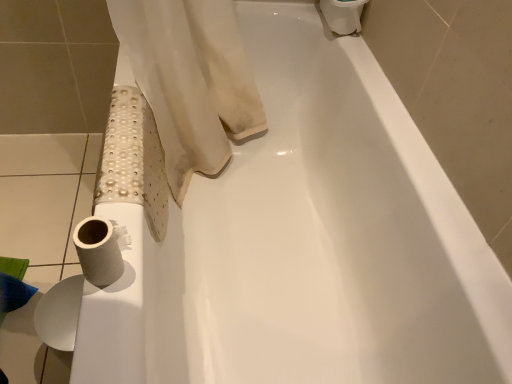
Question: From the image's perspective, does white matte toilet paper at upper right, which is counted as the first toilet paper, starting from the right, appear higher than white matte toilet paper at lower left, the 2th toilet paper when ordered from back to front?

Choices:
 (A) yes
 (B) no

Answer: (A)

Question: Does white matte toilet paper at upper right, arranged as the third toilet paper when viewed from the front, appear on the right side of white matte toilet paper at lower left, the 3th toilet paper in the right-to-left sequence?

Choices:
 (A) no
 (B) yes

Answer: (B)

Question: From the image's perspective, does white matte toilet paper at upper right, arranged as the third toilet paper when viewed from the front, appear lower than white matte toilet paper at lower left, arranged as the 2th toilet paper when viewed from the front?

Choices:
 (A) no
 (B) yes

Answer: (A)

Question: From a real-world perspective, does white matte toilet paper at upper right, arranged as the third toilet paper when viewed from the front, sit lower than white matte toilet paper at lower left, the first toilet paper in the left-to-right sequence?

Choices:
 (A) yes
 (B) no

Answer: (B)

Question: Can you confirm if white matte toilet paper at upper right, the 1th toilet paper viewed from the top, is smaller than white matte toilet paper at lower left, arranged as the 2th toilet paper when viewed from the front?

Choices:
 (A) no
 (B) yes

Answer: (A)

Question: Is the position of white matte toilet paper at upper right, arranged as the third toilet paper when viewed from the front, more distant than that of white matte toilet paper at lower left, the 3th toilet paper in the right-to-left sequence?

Choices:
 (A) yes
 (B) no

Answer: (A)

Question: From a real-world perspective, is white matte toilet paper at lower left, the first toilet paper in the left-to-right sequence, positioned under white matte toilet paper at upper right, arranged as the third toilet paper when viewed from the front, based on gravity?

Choices:
 (A) no
 (B) yes

Answer: (B)

Question: Is white matte toilet paper at lower left, the third toilet paper when ordered from top to bottom, positioned behind white matte toilet paper at upper right, arranged as the third toilet paper when viewed from the front?

Choices:
 (A) yes
 (B) no

Answer: (B)

Question: Is white matte toilet paper at lower left, the 3th toilet paper in the right-to-left sequence, closer to camera compared to white matte toilet paper at upper right, arranged as the third toilet paper when viewed from the front?

Choices:
 (A) no
 (B) yes

Answer: (B)

Question: Is white matte toilet paper at lower left, the first toilet paper in the left-to-right sequence, outside white matte toilet paper at upper right, arranged as the third toilet paper when viewed from the front?

Choices:
 (A) yes
 (B) no

Answer: (A)

Question: Is white matte toilet paper at upper right, arranged as the third toilet paper when viewed from the front, inside white matte toilet paper at lower left, arranged as the 2th toilet paper when viewed from the front?

Choices:
 (A) no
 (B) yes

Answer: (A)

Question: From the image's perspective, is white matte toilet paper at lower left, arranged as the 2th toilet paper when viewed from the front, above white matte toilet paper at upper right, the 1th toilet paper viewed from the top?

Choices:
 (A) yes
 (B) no

Answer: (B)

Question: Is white matte toilet paper at lower left, which is counted as the second toilet paper, starting from the left, next to white matte toilet paper at upper right, the 1th toilet paper viewed from the top?

Choices:
 (A) no
 (B) yes

Answer: (A)